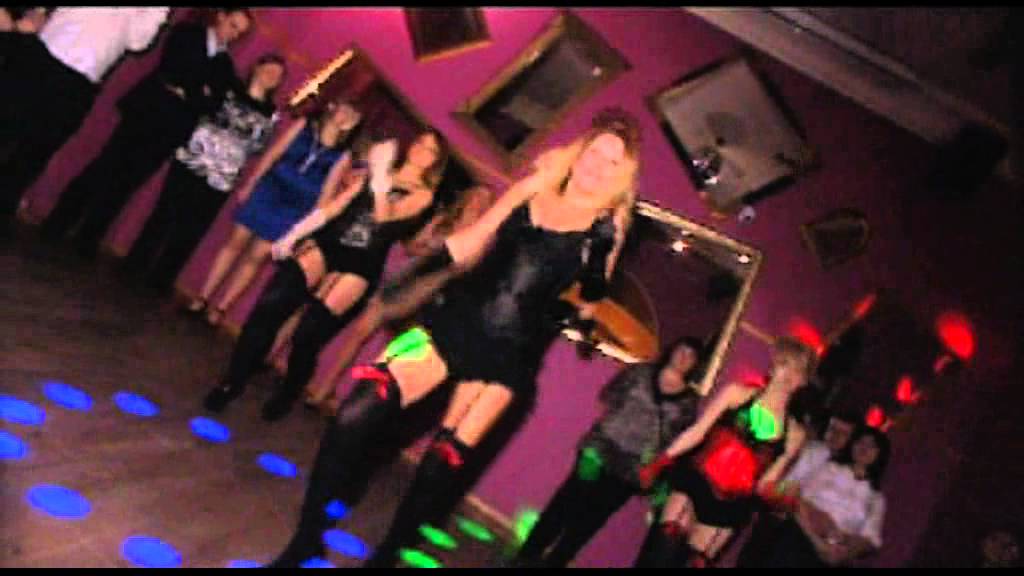
At what (x,y) coordinates should I click in order to perform the action: click on turned picture. Please return your answer as a coordinate pair (x, y). Image resolution: width=1024 pixels, height=576 pixels. Looking at the image, I should click on (190, 126), (502, 262), (640, 342), (804, 446), (997, 528).